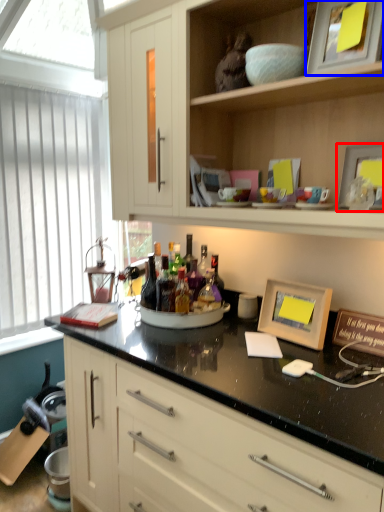
Question: Which object is closer to the camera taking this photo, picture frame (highlighted by a red box) or picture frame (highlighted by a blue box)?

Choices:
 (A) picture frame
 (B) picture frame

Answer: (B)